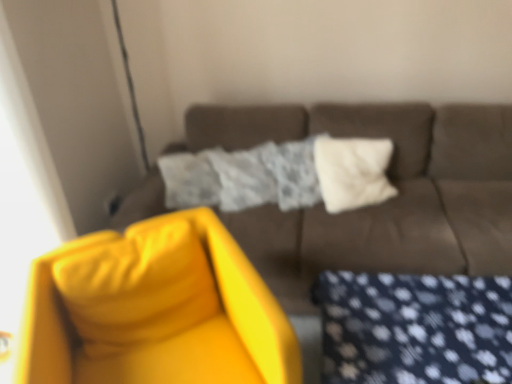
Question: From the image's perspective, is matte yellow swivel chair at left above or below matte brown couch at center?

Choices:
 (A) above
 (B) below

Answer: (B)

Question: Looking at the image, does matte yellow swivel chair at left seem bigger or smaller compared to matte brown couch at center?

Choices:
 (A) small
 (B) big

Answer: (A)

Question: Which is nearer to the matte yellow swivel chair at left?

Choices:
 (A) matte brown couch at center
 (B) white soft pillow at center

Answer: (A)

Question: Estimate the real-world distances between objects in this image. Which object is farther from the matte yellow swivel chair at left?

Choices:
 (A) white soft pillow at center
 (B) matte brown couch at center

Answer: (A)